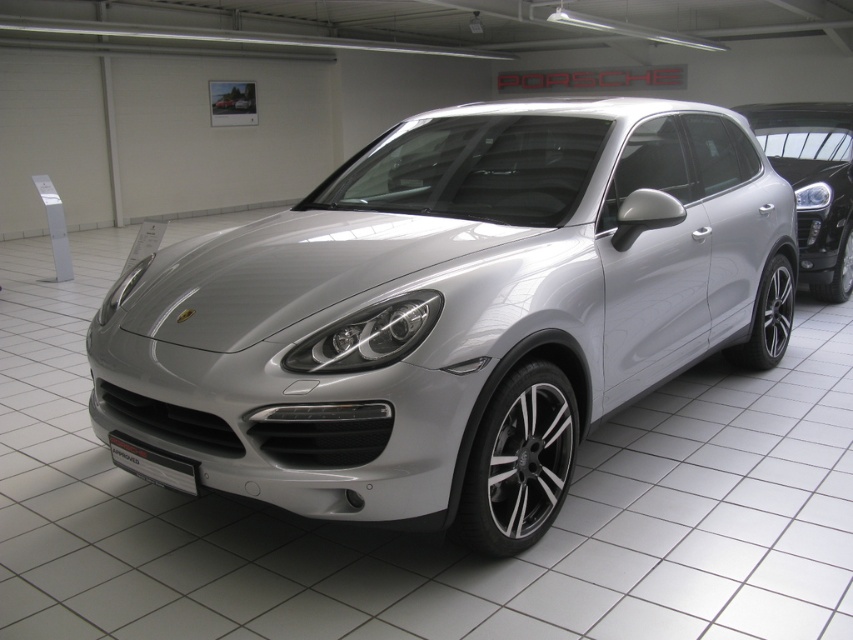
You are a customer in the Porsche showroom and want to know which SUV is bigger between the silver metallic suv at center and the satin silver suv at center. Can you tell me which one is larger?

The silver metallic suv at center is larger than the satin silver suv at center according to the description provided.

You are a delivery person trying to park a delivery van that is 2 meters wide. You see the silver metallic suv at center and the satin silver suv at center in the showroom. Can you determine if there is enough space between them to park your van?

The silver metallic suv at center might be wider than satin silver suv at center, so it is uncertain if there is enough space between them to park the delivery van that is 2 meters wide. You should measure the distance first before attempting to park.